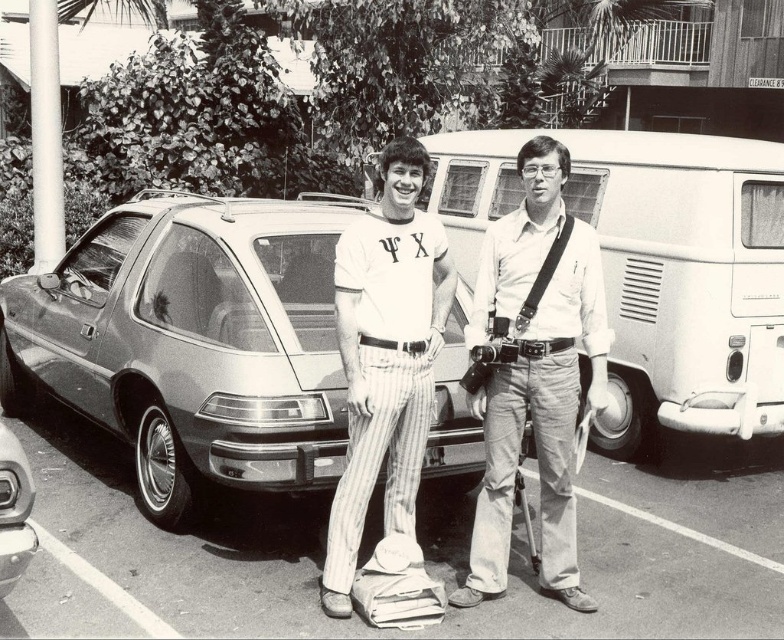
This screenshot has width=784, height=640. What do you see at coordinates (321, 554) in the screenshot? I see `smooth asphalt parking lot at center` at bounding box center [321, 554].

Does smooth asphalt parking lot at center have a lesser height compared to shiny chrome bumper at lower left?

Yes, smooth asphalt parking lot at center is shorter than shiny chrome bumper at lower left.

Is point (369, 636) positioned in front of point (17, 500)?

No, (369, 636) is further to viewer.

Locate an element on the screen. This screenshot has width=784, height=640. smooth asphalt parking lot at center is located at coordinates (321, 554).

Is white matte van at center taller than matte white shirt at center?

Yes, white matte van at center is taller than matte white shirt at center.

Can you confirm if white matte van at center is thinner than matte white shirt at center?

Incorrect, white matte van at center's width is not less than matte white shirt at center's.

Locate an element on the screen. This screenshot has width=784, height=640. white matte van at center is located at coordinates (684, 282).

Locate an element on the screen. The image size is (784, 640). white matte van at center is located at coordinates (684, 282).

What do you see at coordinates (321, 554) in the screenshot? The height and width of the screenshot is (640, 784). I see `smooth asphalt parking lot at center` at bounding box center [321, 554].

Does smooth asphalt parking lot at center appear under matte white shirt at center?

Indeed, smooth asphalt parking lot at center is positioned under matte white shirt at center.

Who is more distant from viewer, (726, 572) or (559, 499)?

Point (726, 572)

You are a GUI agent. You are given a task and a screenshot of the screen. Output one action in this format:
    pyautogui.click(x=<x>, y=<y>)
    Task: Click on the smooth asphalt parking lot at center
    This screenshot has width=784, height=640.
    Given the screenshot: What is the action you would take?
    pyautogui.click(x=321, y=554)